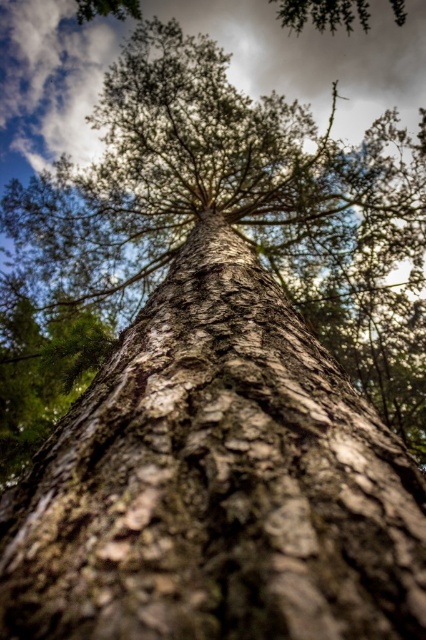
You are standing near the base of the brown rough bark tree trunk at center and looking up. Can you see the white fluffy cloud at upper center through the tree branches?

The brown rough bark tree trunk at center is in front of the white fluffy cloud at upper center, so the tree trunk blocks your view of the cloud.

You are standing directly in front of the tree. Where is the brown rough bark tree trunk at center located relative to your viewpoint?

The brown rough bark tree trunk at center is located at point (215, 483) relative to your viewpoint.

You are standing in a forest and looking up at the brown rough bark tree trunk at center and the white fluffy cloud at upper center. Which object is positioned to the left side from your perspective?

The brown rough bark tree trunk at center is positioned to the left of the white fluffy cloud at upper center.